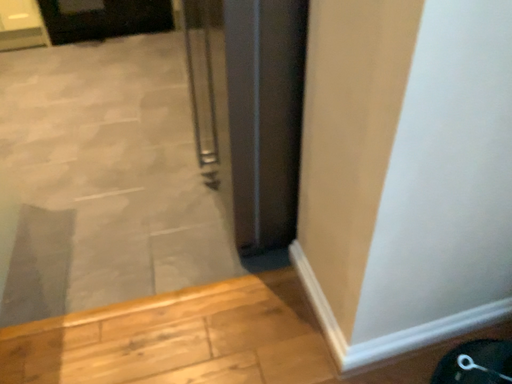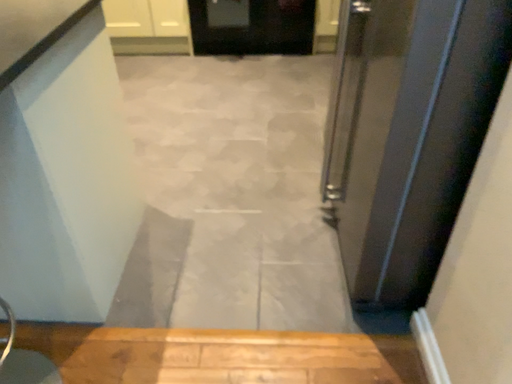
Question: How did the camera likely rotate when shooting the video?

Choices:
 (A) rotated right
 (B) rotated left

Answer: (B)